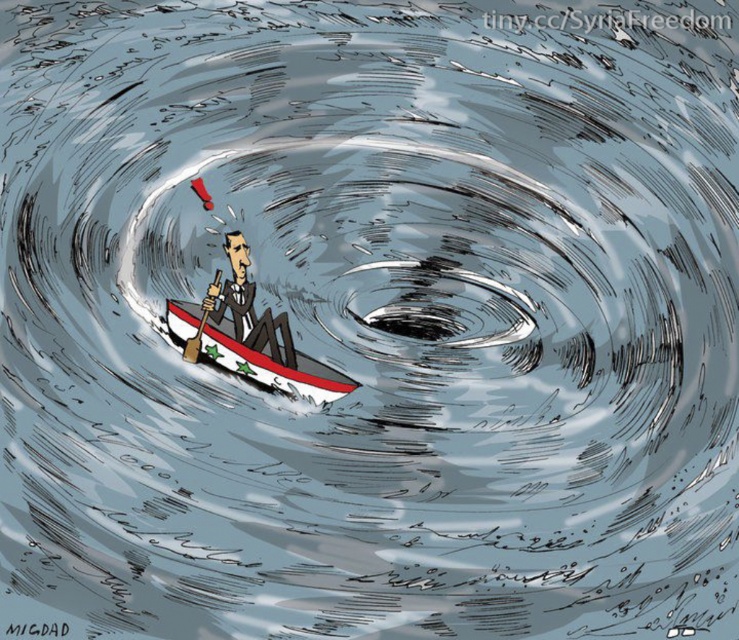
In the political cartoon, there is a white glossy boat at center and a dark gray suit at center. Which object is positioned to the right of the other?

The white glossy boat at center is to the right of the dark gray suit at center.

You are a sailor trying to navigate through the chaotic waters in the political cartoon. You see the white glossy boat at center and the brown wood paddle at center. Which object is closer to you?

The white glossy boat at center is positioned under the brown wood paddle at center, so the brown wood paddle at center is closer to you.